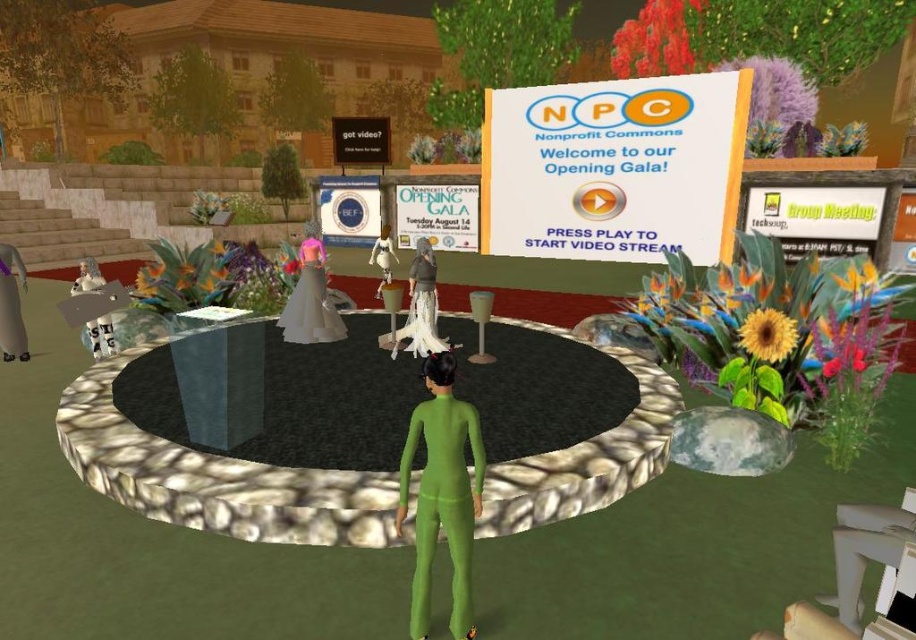
Question: Among these objects, which one is farthest from the camera?

Choices:
 (A) green matte/skinny at center
 (B) white matte dress at center
 (C) white fabric dress at center
 (D) matte gray dress at center

Answer: (B)

Question: Which point is farther to the camera?

Choices:
 (A) (289, 323)
 (B) (5, 257)
 (C) (372, 259)
 (D) (89, 273)

Answer: (C)

Question: Considering the real-world distances, which object is closest to the green matte/skinny at center?

Choices:
 (A) white matte statue at lower left
 (B) green rubber person at center
 (C) white fabric dress at center
 (D) matte gray dress at center

Answer: (C)

Question: Is matte gray dress at center further to camera compared to white fabric dress at center?

Choices:
 (A) no
 (B) yes

Answer: (B)

Question: Can you confirm if green rubber person at center is positioned to the left of white matte statue at lower left?

Choices:
 (A) no
 (B) yes

Answer: (B)

Question: Considering the relative positions of green matte/skinny at center and matte gray dress at center in the image provided, where is green matte/skinny at center located with respect to matte gray dress at center?

Choices:
 (A) left
 (B) right

Answer: (B)